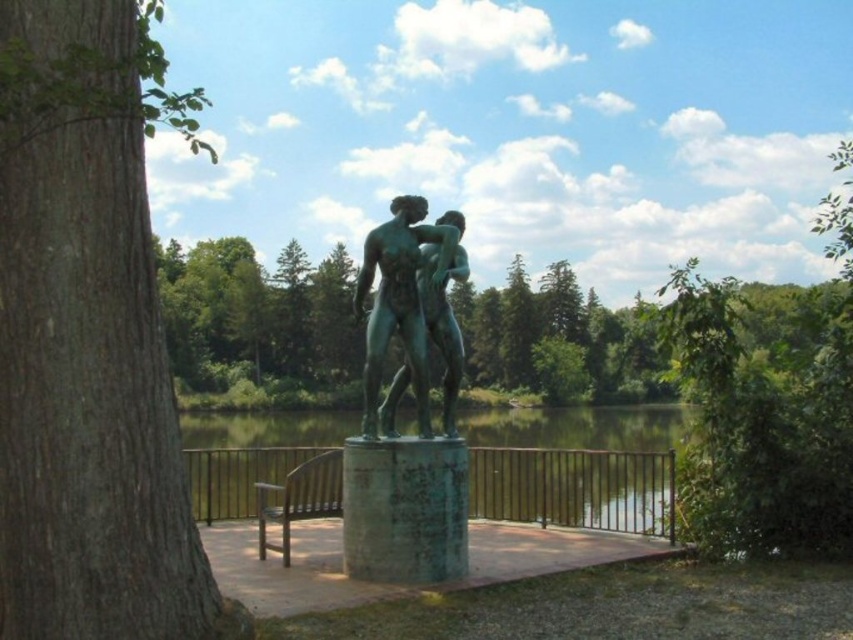
Question: Can you confirm if green rough bark tree at left is thinner than wooden park bench at lower center?

Choices:
 (A) yes
 (B) no

Answer: (B)

Question: Estimate the real-world distances between objects in this image. Which object is closer to the green rough bark tree at left?

Choices:
 (A) green patina statue at center
 (B) wooden park bench at lower center

Answer: (A)

Question: Is green rough bark tree at left thinner than green patina statue at center?

Choices:
 (A) yes
 (B) no

Answer: (B)

Question: Which point is closer to the camera?

Choices:
 (A) (628, 467)
 (B) (16, 512)

Answer: (B)

Question: Does green rough bark tree at left have a lesser width compared to greenish reflective water at center?

Choices:
 (A) no
 (B) yes

Answer: (B)

Question: Which point is farther to the camera?

Choices:
 (A) wooden park bench at lower center
 (B) greenish reflective water at center
 (C) green rough bark tree at left
 (D) green patina statue at center

Answer: (B)